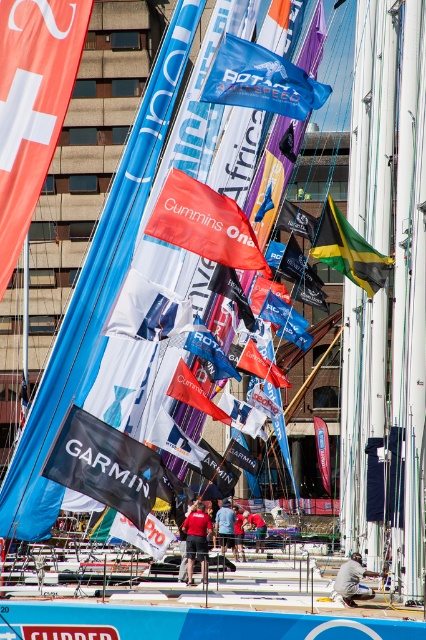
You are a photographer trying to capture a clear shot of both the red fabric flag at upper left and the red fabric flag at center. Since you want both flags to be visible in your photo, which flag should you focus on first to ensure both are in frame?

The red fabric flag at upper left is located above the red fabric flag at center. To ensure both are in frame, focus on the red fabric flag at upper left first as it is higher up, allowing you to adjust the camera angle to include the lower flag as well.